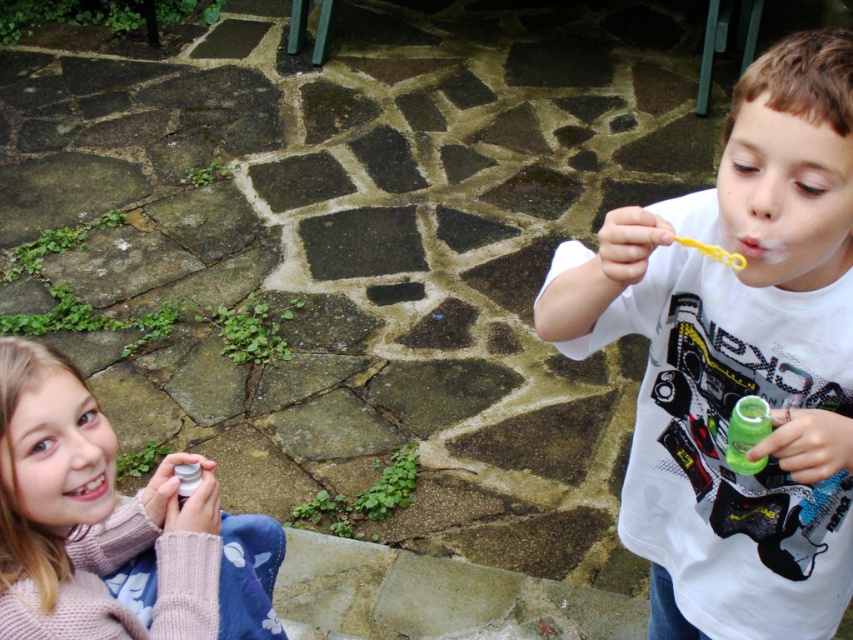
Question: Which point is closer to the camera taking this photo?

Choices:
 (A) (734, 456)
 (B) (177, 492)
 (C) (752, 252)
 (D) (169, 541)

Answer: (C)

Question: Which of the following is the farthest from the observer?

Choices:
 (A) white glossy teeth at lower left
 (B) pink knitted sweater at lower left
 (C) white matte shirt at center
 (D) green translucent bottle at right

Answer: (D)

Question: Can you confirm if white matte shirt at center is positioned below white glossy teeth at lower left?

Choices:
 (A) no
 (B) yes

Answer: (B)

Question: Is green translucent bottle at right to the left of translucent plastic bottle at lower left from the viewer's perspective?

Choices:
 (A) no
 (B) yes

Answer: (A)

Question: Which object is the closest to the translucent plastic bottle at lower left?

Choices:
 (A) white glossy teeth at lower left
 (B) smooth yellow toothbrush at upper right
 (C) green translucent bottle at right

Answer: (A)

Question: Is white glossy teeth at lower left to the left of translucent plastic bottle at lower left from the viewer's perspective?

Choices:
 (A) yes
 (B) no

Answer: (A)